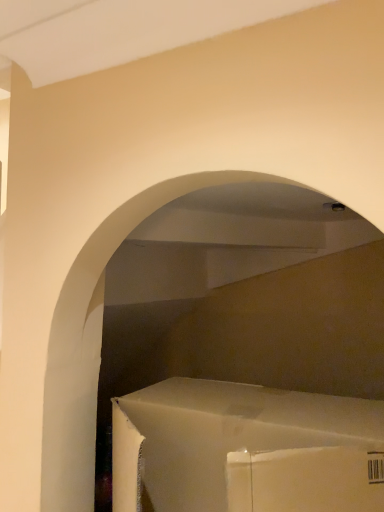
The height and width of the screenshot is (512, 384). What do you see at coordinates (245, 449) in the screenshot? I see `white cardboard box at lower center` at bounding box center [245, 449].

Find the location of a particular element. The width and height of the screenshot is (384, 512). white cardboard box at lower center is located at coordinates (245, 449).

Where is `white cardboard box at lower center`? The width and height of the screenshot is (384, 512). white cardboard box at lower center is located at coordinates (245, 449).